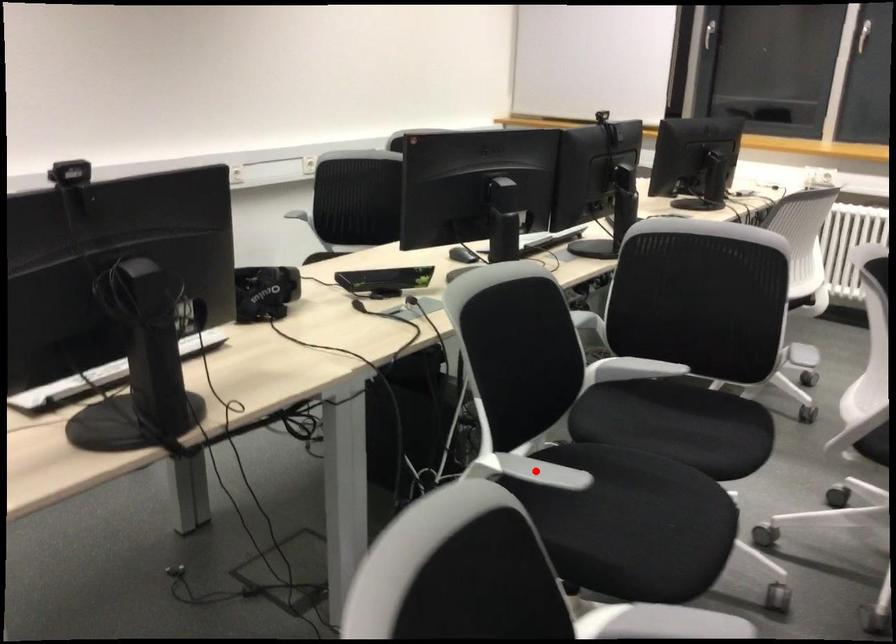
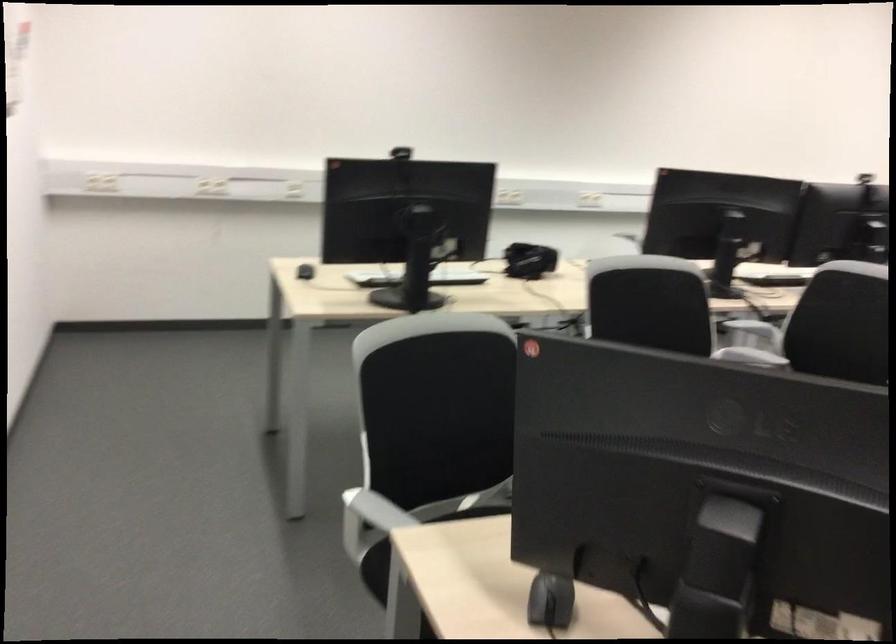
Question: I am providing you with two images of the same scene from different viewpoints. A red point is marked on the first image. Can you still see the location of the red point in image 2?

Choices:
 (A) Yes
 (B) No

Answer: (B)